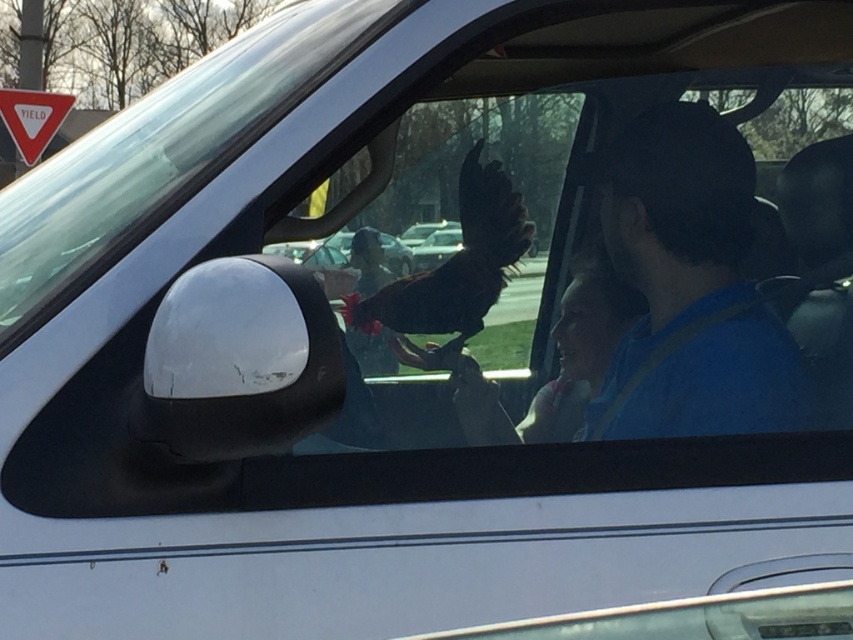
From the picture: You are a pedestrian standing outside the car and looking through the front passenger window. You see the transparent glass windshield at center and the yield sign at upper left. Which object is closer to you?

The transparent glass windshield at center is closer to you because it is in front of the yield sign at upper left.

You are a pedestrian standing at the crosswalk. You see a car approaching with its front passenger window open. You notice a yield sign at upper left and a transparent glass windshield at center. Which object is closer to the left side of your view?

The yield sign at upper left is closer to the left side of your view because it is positioned to the left of the transparent glass windshield at center.